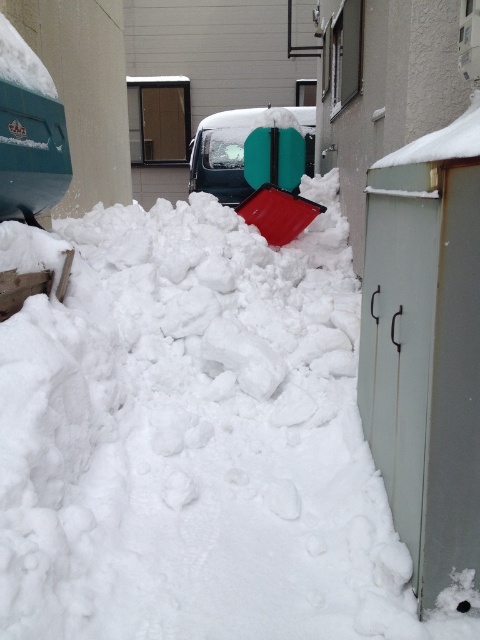
You are a delivery person trying to deliver a package to the green matte van at center. The snow is very deep here. Can you walk directly to the van through the white fluffy snow at center?

The white fluffy snow at center has a greater height compared to the green matte van at center, which means the snow is deeper than the van. This makes it difficult to walk directly to the van through the snow as it might sink deeply into the snow.